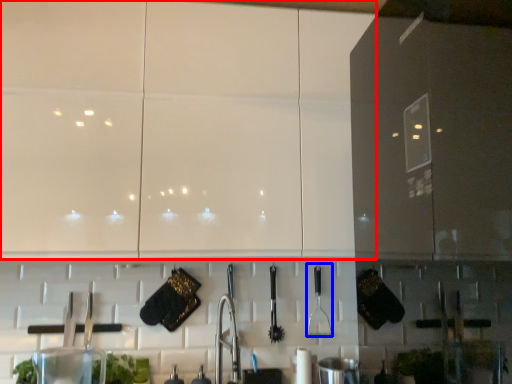
Question: Which of the following is the farthest to the observer, cabinetry (highlighted by a red box) or silverware (highlighted by a blue box)?

Choices:
 (A) cabinetry
 (B) silverware

Answer: (B)